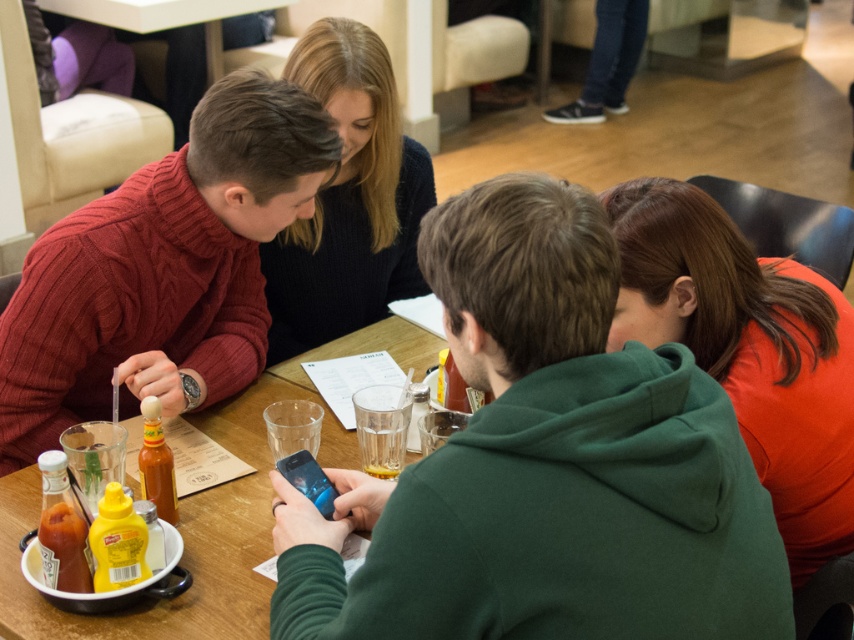
You are a photographer standing at the back of the room. You want to take a photo of the knitted dark blue sweater at upper center and the translucent plastic bottle at center such that both are in focus. The camera you are using has a depth of field that can only cover 70 centimeters. Can you capture both objects in focus without moving your position?

The knitted dark blue sweater at upper center and translucent plastic bottle at center are 77.31 centimeters apart from each other. Since the depth of field can only cover 70 centimeters, the distance between them exceeds the camera s capability, so you cannot capture both in focus without moving.

You are at a restaurant table with several people. You need to pass a napkin from the translucent plastic bottle at center to the orange matte shirt at lower right. Which direction should you move the napkin?

The orange matte shirt at lower right is to the right of the translucent plastic bottle at center, so you should move the napkin to the right to reach it.